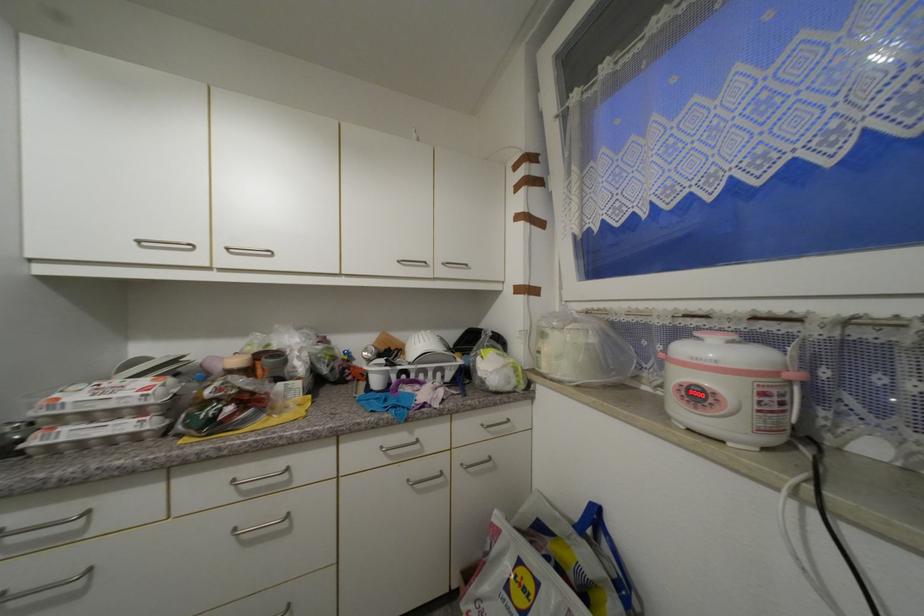
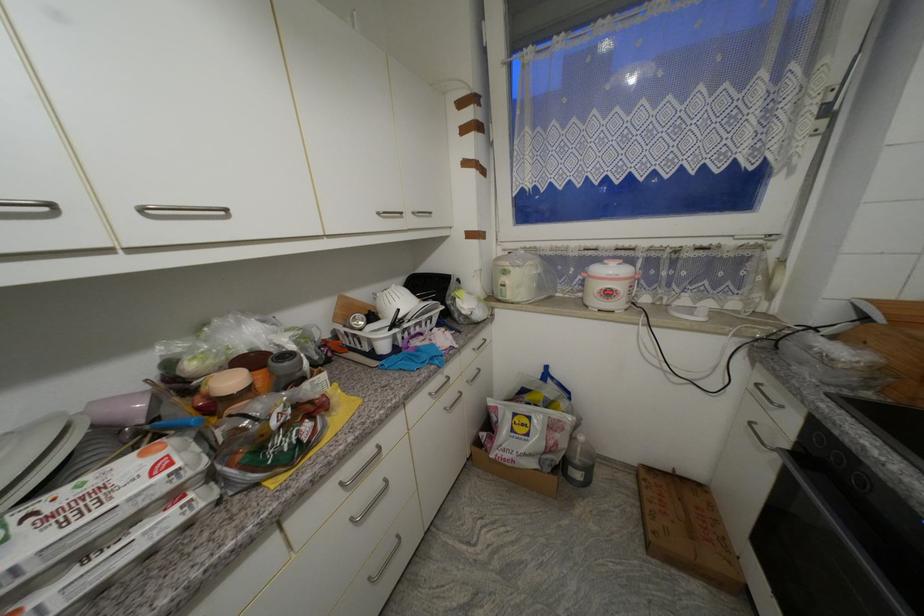
Find the pixel in the second image that matches point (147, 413) in the first image.

(178, 498)